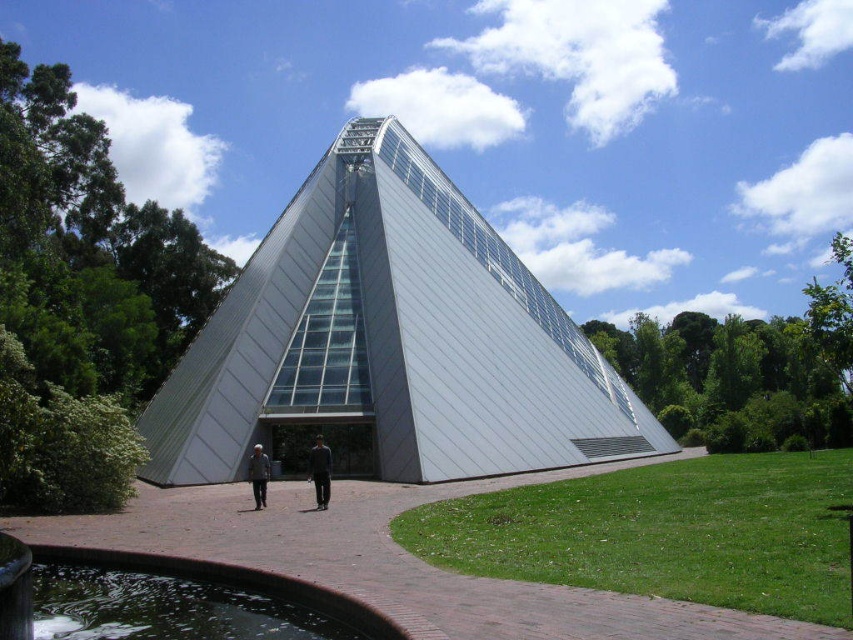
Between white glass pyramid at center and dark gray suit at center, which one appears on the right side from the viewer's perspective?

white glass pyramid at center

What do you see at coordinates (392, 339) in the screenshot? This screenshot has width=853, height=640. I see `white glass pyramid at center` at bounding box center [392, 339].

The height and width of the screenshot is (640, 853). Find the location of `white glass pyramid at center`. white glass pyramid at center is located at coordinates (392, 339).

Which is behind, point (497, 477) or point (254, 449)?

Point (497, 477)

Find the location of a particular element. brick path at center is located at coordinates (397, 561).

You are a GUI agent. You are given a task and a screenshot of the screen. Output one action in this format:
    pyautogui.click(x=<x>, y=<y>)
    Task: Click on the brick path at center
    This screenshot has height=640, width=853.
    Given the screenshot: What is the action you would take?
    pyautogui.click(x=397, y=561)

Who is shorter, dark gray suit at center or gray fabric jacket at center?

gray fabric jacket at center

Which is in front, point (312, 477) or point (247, 474)?

Point (312, 477)

You are a GUI agent. You are given a task and a screenshot of the screen. Output one action in this format:
    pyautogui.click(x=<x>, y=<y>)
    Task: Click on the dark gray suit at center
    The image size is (853, 640).
    Given the screenshot: What is the action you would take?
    pyautogui.click(x=320, y=472)